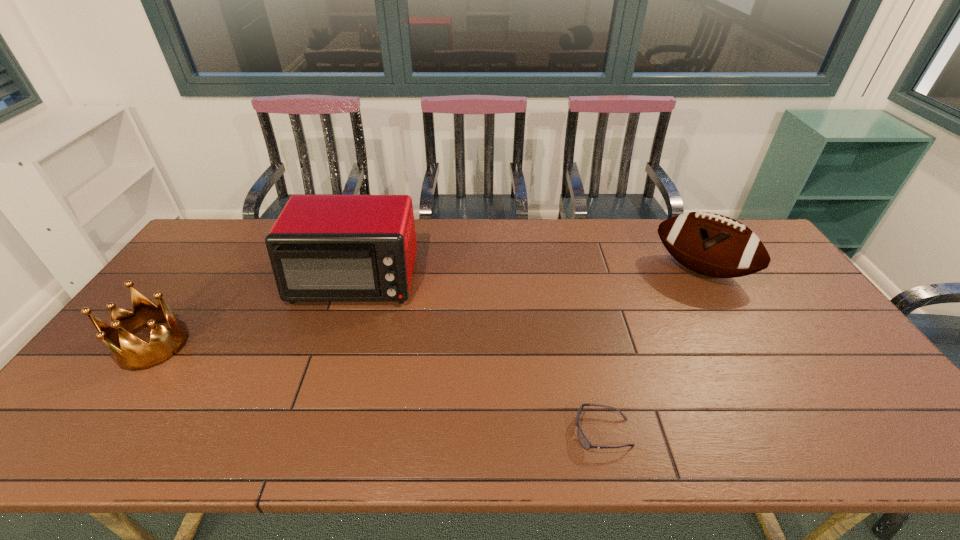
What are the coordinates of `vacant space located 0.070m on the lenses of the shortest object` in the screenshot? It's located at (544, 432).

Identify the location of blank space located on the lenses of the shortest object. (527, 432).

I want to click on toaster oven that is at the far edge, so click(323, 248).

Identify the location of football (American) that is at the far edge. The width and height of the screenshot is (960, 540). (710, 244).

Locate an element on the screen. The height and width of the screenshot is (540, 960). object located in the near edge section of the desktop is located at coordinates (584, 442).

You are a GUI agent. You are given a task and a screenshot of the screen. Output one action in this format:
    pyautogui.click(x=<x>, y=<y>)
    Task: Click on the object that is at the left edge
    
    Given the screenshot: What is the action you would take?
    pyautogui.click(x=135, y=354)

You are a GUI agent. You are given a task and a screenshot of the screen. Output one action in this format:
    pyautogui.click(x=<x>, y=<y>)
    Task: Click on the object that is at the right edge
    This screenshot has width=960, height=540.
    Given the screenshot: What is the action you would take?
    pyautogui.click(x=710, y=244)

Find the location of `object that is at the far right corner`. object that is at the far right corner is located at coordinates (710, 244).

The image size is (960, 540). In the image, there is a desktop. What are the coordinates of `vacant space at the far edge` in the screenshot? It's located at (496, 226).

Identify the location of free space at the near edge. The width and height of the screenshot is (960, 540). (503, 431).